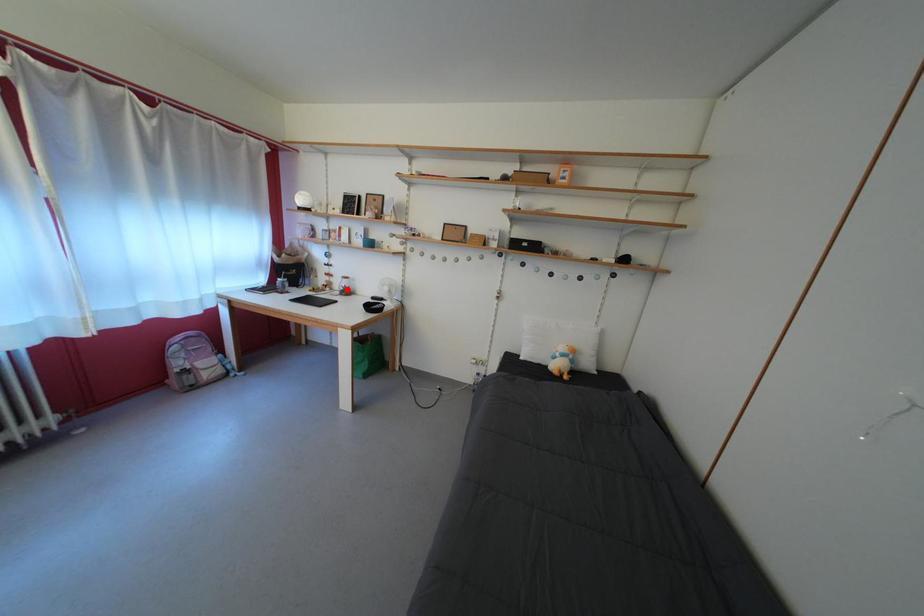
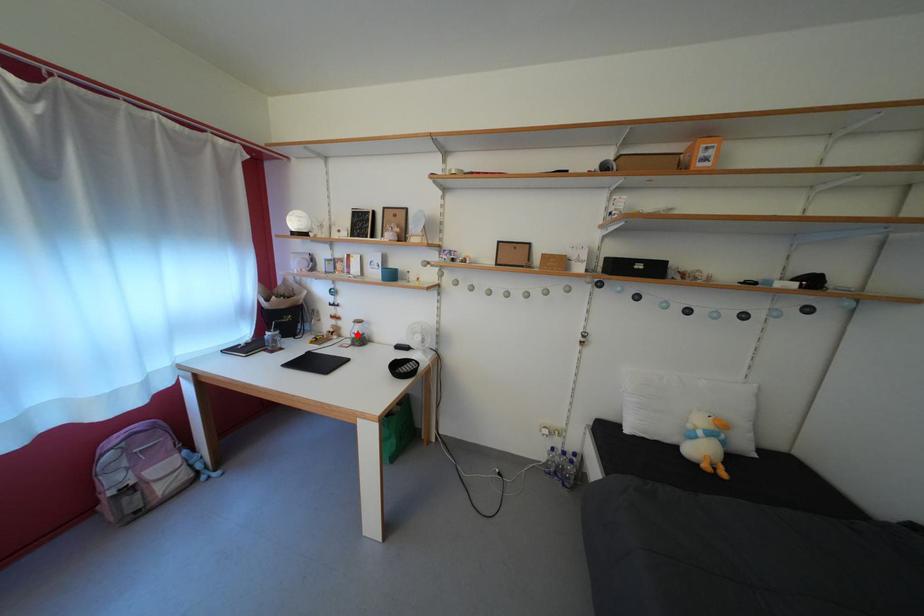
I am providing you with two images of the same scene from different viewpoints. A red point is marked on the first image and another point is marked on the second image. Are the points marked in image1 and image2 representing the same 3D position?

Yes